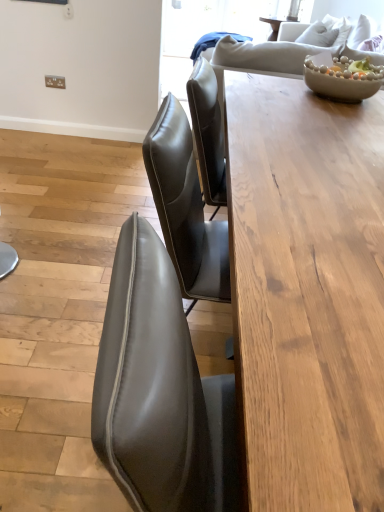
The image size is (384, 512). I want to click on matte beige bowl at upper right, so click(340, 78).

What do you see at coordinates (340, 78) in the screenshot?
I see `matte beige bowl at upper right` at bounding box center [340, 78].

The width and height of the screenshot is (384, 512). I want to click on wooden table at center, so pyautogui.click(x=307, y=293).

Describe the element at coordinates (307, 293) in the screenshot. The width and height of the screenshot is (384, 512). I see `wooden table at center` at that location.

Locate an element on the screen. matte beige bowl at upper right is located at coordinates (340, 78).

Between matte beige bowl at upper right and wooden table at center, which one appears on the right side from the viewer's perspective?

Positioned to the right is matte beige bowl at upper right.

Which is behind, matte beige bowl at upper right or wooden table at center?

matte beige bowl at upper right is further away from the camera.

Is point (304, 60) positioned in front of point (372, 297)?

No, it is behind (372, 297).

From the image's perspective, between matte beige bowl at upper right and wooden table at center, which one is located above?

matte beige bowl at upper right appears higher in the image.

From a real-world perspective, who is located lower, matte beige bowl at upper right or wooden table at center?

wooden table at center is physically lower.

Is matte beige bowl at upper right wider than wooden table at center?

No, matte beige bowl at upper right is not wider than wooden table at center.

Does matte beige bowl at upper right have a greater height compared to wooden table at center?

No.

Considering the relative sizes of matte beige bowl at upper right and wooden table at center in the image provided, is matte beige bowl at upper right smaller than wooden table at center?

Yes, matte beige bowl at upper right is smaller than wooden table at center.

Is matte beige bowl at upper right inside or outside of wooden table at center?

matte beige bowl at upper right exists outside the volume of wooden table at center.

From the picture: Is there a large distance between matte beige bowl at upper right and wooden table at center?

That's not correct — matte beige bowl at upper right is a little close to wooden table at center.

Is wooden table at center at the back of matte beige bowl at upper right?

No, matte beige bowl at upper right is not facing the opposite direction of wooden table at center.

Where is `bowl above the wooden table at center (from the image's perspective)`? bowl above the wooden table at center (from the image's perspective) is located at coordinates (340, 78).

Based on their positions, is wooden table at center located to the left or right of matte beige bowl at upper right?

From the image, it's evident that wooden table at center is to the left of matte beige bowl at upper right.

Is wooden table at center in front of or behind matte beige bowl at upper right in the image?

wooden table at center is in front of matte beige bowl at upper right.

Is point (309, 435) farther from viewer compared to point (313, 66)?

No, it is not.

From the image's perspective, is wooden table at center on matte beige bowl at upper right?

No, from the image's perspective, wooden table at center is not over matte beige bowl at upper right.

Based on the photo, from a real-world perspective, is wooden table at center positioned above or below matte beige bowl at upper right?

Clearly, from a real-world perspective, wooden table at center is below matte beige bowl at upper right.

Looking at their sizes, would you say wooden table at center is wider or thinner than matte beige bowl at upper right?

In the image, wooden table at center appears to be wider than matte beige bowl at upper right.

Based on the photo, which of these two, wooden table at center or matte beige bowl at upper right, stands taller?

wooden table at center is taller.

Which of these two, wooden table at center or matte beige bowl at upper right, is smaller?

matte beige bowl at upper right is smaller.

Is matte beige bowl at upper right inside wooden table at center?

Definitely not — matte beige bowl at upper right is not inside wooden table at center.

Looking at this image, are wooden table at center and matte beige bowl at upper right far apart?

No, wooden table at center is in close proximity to matte beige bowl at upper right.

Is matte beige bowl at upper right at the back of wooden table at center?

wooden table at center is not turned away from matte beige bowl at upper right.

Can you tell me how much wooden table at center and matte beige bowl at upper right differ in facing direction?

The angle between the facing direction of wooden table at center and the facing direction of matte beige bowl at upper right is 89 degrees.

Find the location of a particular element. table below the matte beige bowl at upper right (from a real-world perspective) is located at coordinates point(307,293).

You are a GUI agent. You are given a task and a screenshot of the screen. Output one action in this format:
    pyautogui.click(x=<x>, y=<y>)
    Task: Click on the table that appears in front of the matte beige bowl at upper right
    The width and height of the screenshot is (384, 512).
    Given the screenshot: What is the action you would take?
    pyautogui.click(x=307, y=293)

Where is `bowl that is behind the wooden table at center`? bowl that is behind the wooden table at center is located at coordinates (340, 78).